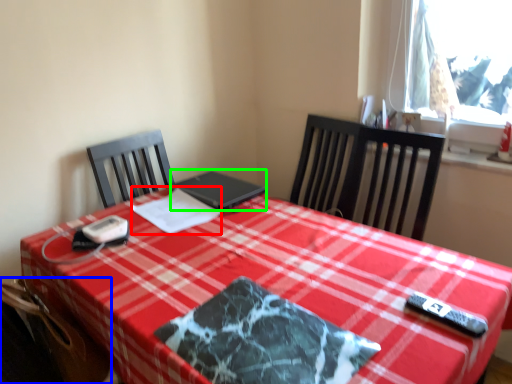
Question: Considering the real-world distances, which object is farthest from linen (highlighted by a red box)? swivel chair (highlighted by a blue box) or laptop (highlighted by a green box)?

Choices:
 (A) swivel chair
 (B) laptop

Answer: (A)